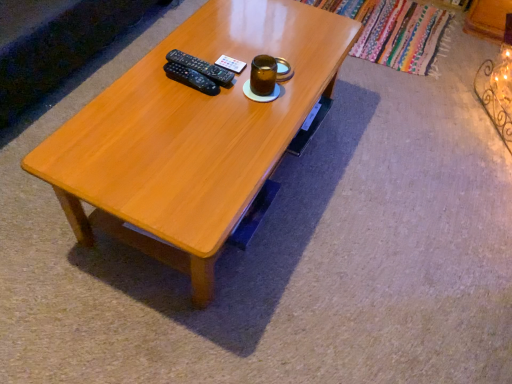
Where is `vacant region in front of light brown wood coffee table at center`? vacant region in front of light brown wood coffee table at center is located at coordinates (208, 316).